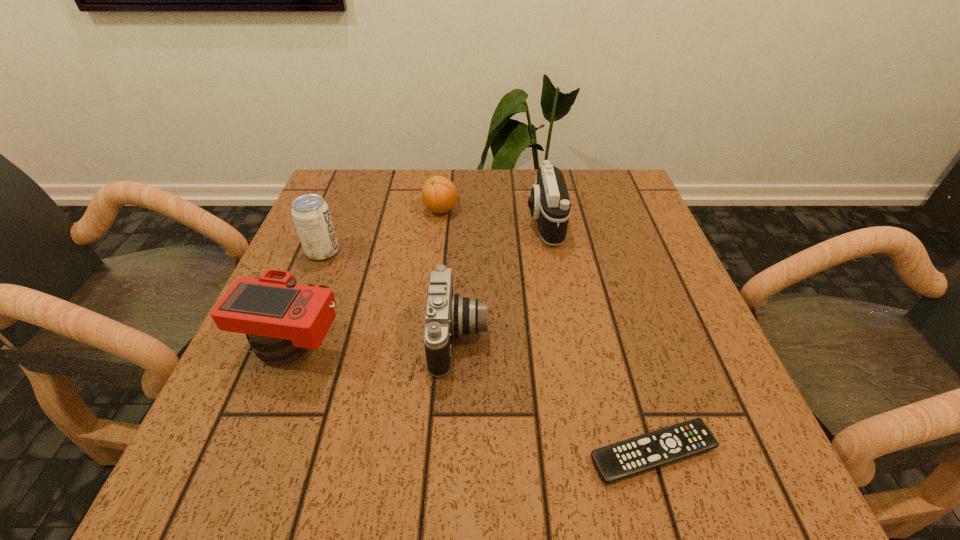
You are a GUI agent. You are given a task and a screenshot of the screen. Output one action in this format:
    pyautogui.click(x=<x>, y=<y>)
    Task: Click on the farthest camera
    This screenshot has width=960, height=540.
    Given the screenshot: What is the action you would take?
    pyautogui.click(x=549, y=202)

In order to click on soda can in this screenshot , I will do `click(311, 215)`.

Where is `the leftmost camera`? The height and width of the screenshot is (540, 960). the leftmost camera is located at coordinates (283, 319).

I want to click on the second camera from right to left, so click(x=447, y=315).

Locate an element on the screen. the second shortest object is located at coordinates (439, 194).

Identify the location of the nearest object. (623, 459).

The image size is (960, 540). I want to click on the shortest object, so click(623, 459).

Identify the location of vacant space located on the front lens of the farthest camera. (428, 222).

Find the location of a particular element. vacant point located 0.340m on the front lens of the farthest camera is located at coordinates (388, 222).

Where is `vacant space located 0.110m on the front lens of the farthest camera`? The width and height of the screenshot is (960, 540). vacant space located 0.110m on the front lens of the farthest camera is located at coordinates (481, 222).